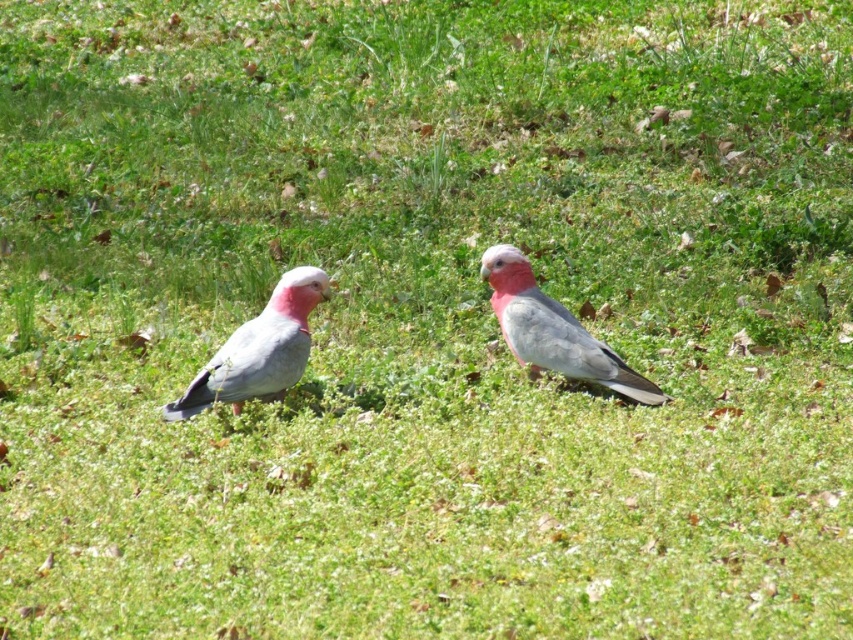
You are a park ranger observing two pink headed galahs in their natural habitat. You notice a point marked at coordinates [259,349]. Which bird is located at this point?

The point at coordinates [259,349] indicates the matte gray bird at center.

You are a birdwatcher trying to take a photo of the matte gray bird at center and the pink feathered parrot at center. Since you want to focus on the one closer to you, which bird should you aim your camera at?

The matte gray bird at center is closer to the viewer than the pink feathered parrot at center, so you should aim your camera at the matte gray bird at center to focus on the closer one.

From the picture: You are a birdwatcher observing two birds in the scene. You notice the matte gray bird at center and the pink feathered parrot at center. Which bird is shorter in height?

The matte gray bird at center is shorter than the pink feathered parrot at center.